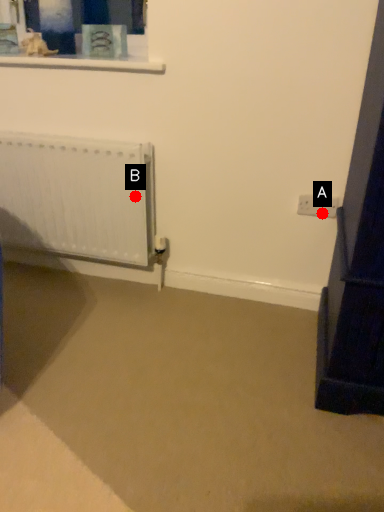
Question: Two points are circled on the image, labeled by A and B beside each circle. Which point appears farthest from the camera in this image?

Choices:
 (A) A is further
 (B) B is further

Answer: (B)